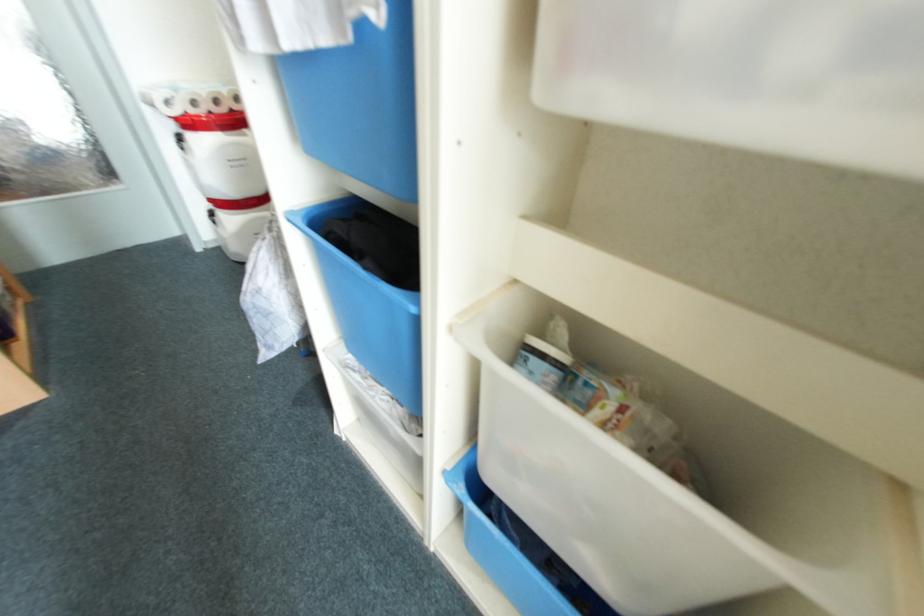
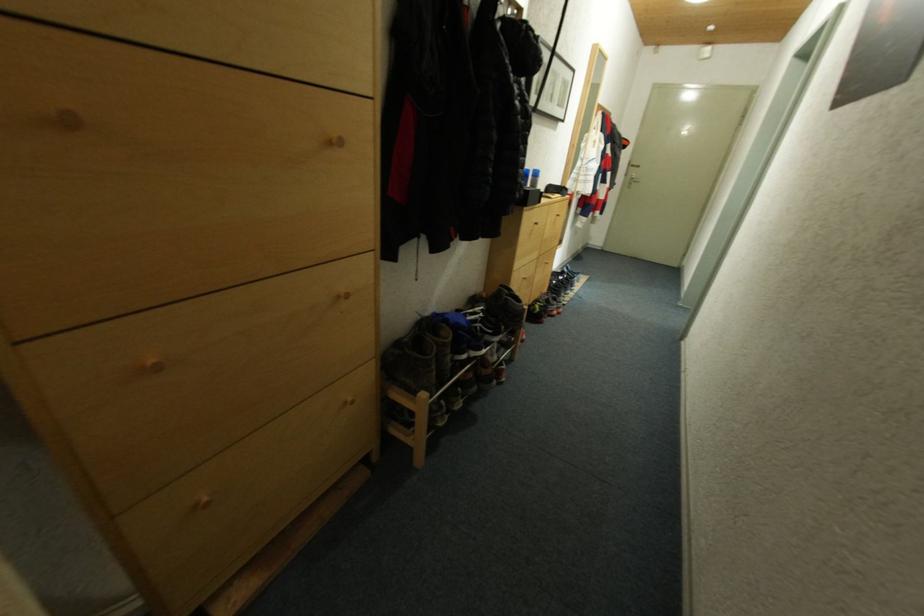
Question: What movement of the cameraman would produce the second image?

Choices:
 (A) Left
 (B) Right
 (C) Forward
 (D) Backward

Answer: (C)